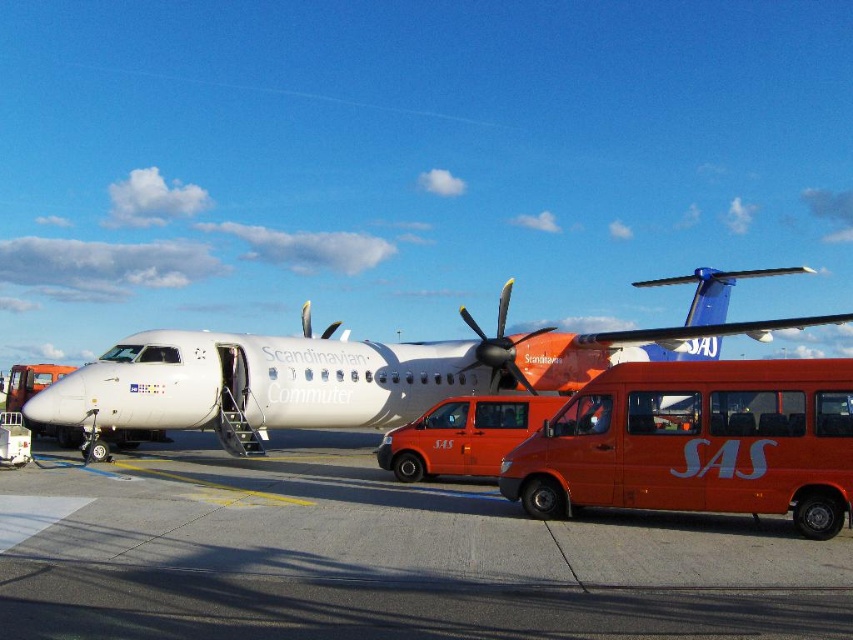
You are standing at the point marked by the coordinates point (381, 561). What material are you standing on?

The concrete at center is located at point (381, 561), so you are standing on concrete.

You are a ground crew member who needs to park an orange van between the concrete at center and the white matte airplane at center. Can the van fit in the space between them based on their widths?

The concrete at center is narrower than the white matte airplane at center, so the space between them may be sufficient for an orange van to fit, but the exact width of the van isn

You are a passenger standing at the front of the Scandinavian Airlines commuter aircraft. You see an orange matte van at center and a yellow metallic propeller at center. Which object is nearer to you?

The orange matte van at center is closer to the viewer than the yellow metallic propeller at center, so the orange matte van at center is nearer to you.